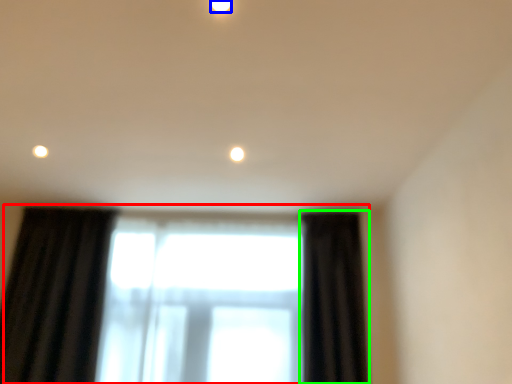
Question: Based on their relative distances, which object is nearer to window (highlighted by a red box)? Choose from lighting (highlighted by a blue box) and curtain (highlighted by a green box).

Choices:
 (A) lighting
 (B) curtain

Answer: (B)